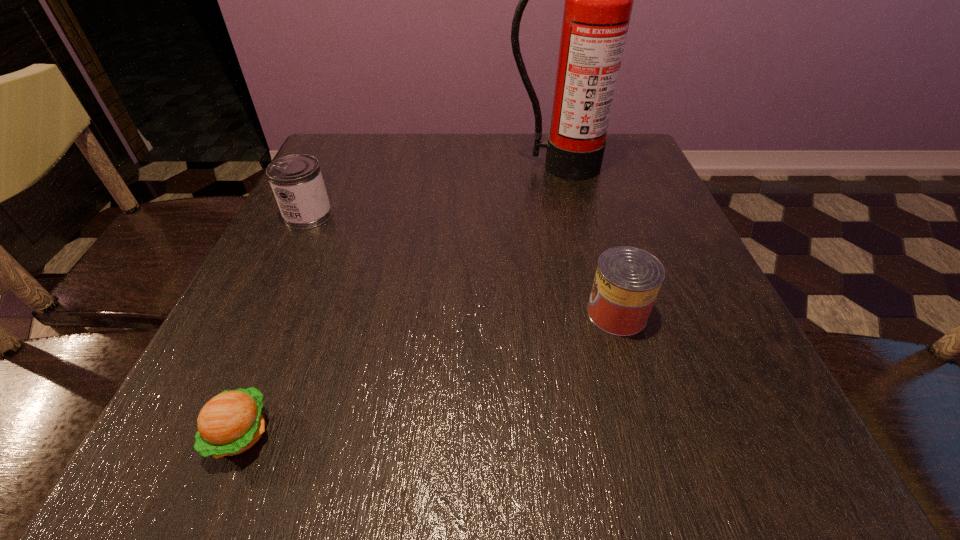
You are a GUI agent. You are given a task and a screenshot of the screen. Output one action in this format:
    pyautogui.click(x=<x>, y=<y>)
    Task: Click on the vacant space situated on the front of the nearer can
    
    Given the screenshot: What is the action you would take?
    (x=640, y=394)

Find the location of a particular element. The image size is (960, 540). vacant space positioned on the back of the hamburger is located at coordinates (325, 227).

Where is `object that is at the far edge`? This screenshot has height=540, width=960. object that is at the far edge is located at coordinates (598, 3).

Locate an element on the screen. The image size is (960, 540). object that is at the near edge is located at coordinates (230, 423).

Find the location of a particular element. Image resolution: width=960 pixels, height=540 pixels. can present at the left edge is located at coordinates (296, 180).

This screenshot has width=960, height=540. Find the location of `hamburger present at the left edge`. hamburger present at the left edge is located at coordinates (230, 423).

You are a GUI agent. You are given a task and a screenshot of the screen. Output one action in this format:
    pyautogui.click(x=<x>, y=<y>)
    Task: Click on the fire extinguisher that is at the right edge
    This screenshot has width=960, height=540.
    Given the screenshot: What is the action you would take?
    pyautogui.click(x=598, y=3)

Identify the location of can located in the right edge section of the desktop. This screenshot has height=540, width=960. (627, 280).

Identify the location of object present at the near left corner. (230, 423).

Locate an element on the screen. The width and height of the screenshot is (960, 540). object at the far right corner is located at coordinates (598, 3).